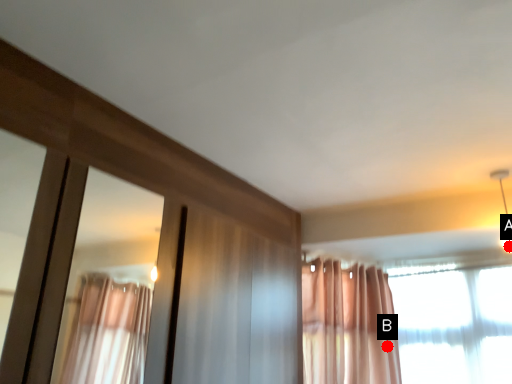
Question: Two points are circled on the image, labeled by A and B beside each circle. Among these points, which one is nearest to the camera?

Choices:
 (A) A is closer
 (B) B is closer

Answer: (A)